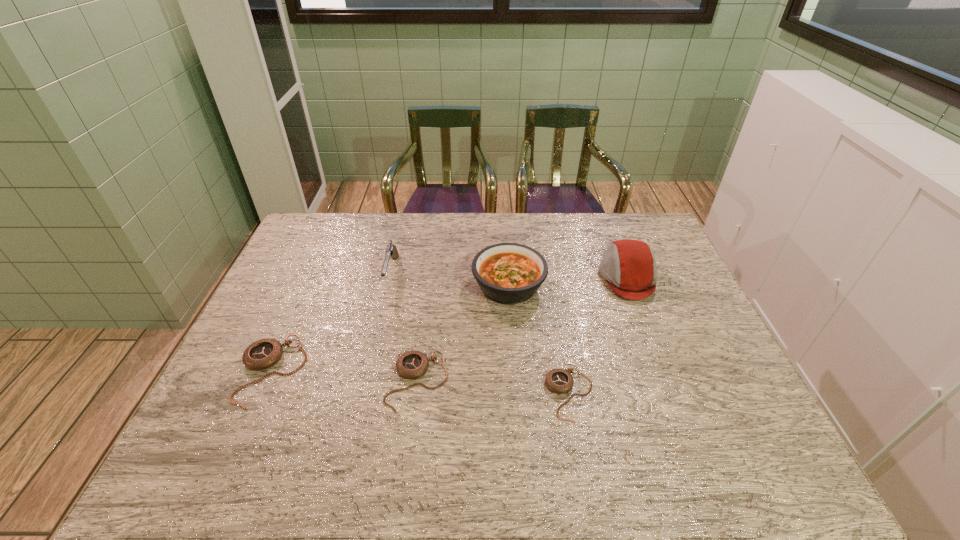
At what (x,y) coordinates should I click in order to perform the action: click on free region that satisfies the following two spatial constraints: 1. on the front side of the second shortest object; 2. on the left side of the leftmost pocket watch. Please return your answer as a coordinate pair (x, y). This screenshot has height=540, width=960. Looking at the image, I should click on (267, 381).

Image resolution: width=960 pixels, height=540 pixels. Find the location of `vacant region that satisfies the following two spatial constraints: 1. aiming along the barrel of the fourth object from right to left; 2. on the left side of the gun`. vacant region that satisfies the following two spatial constraints: 1. aiming along the barrel of the fourth object from right to left; 2. on the left side of the gun is located at coordinates (367, 381).

Find the location of a particular element. The image size is (960, 540). free space that satisfies the following two spatial constraints: 1. on the front side of the shortest object; 2. on the right side of the leftmost object is located at coordinates (262, 393).